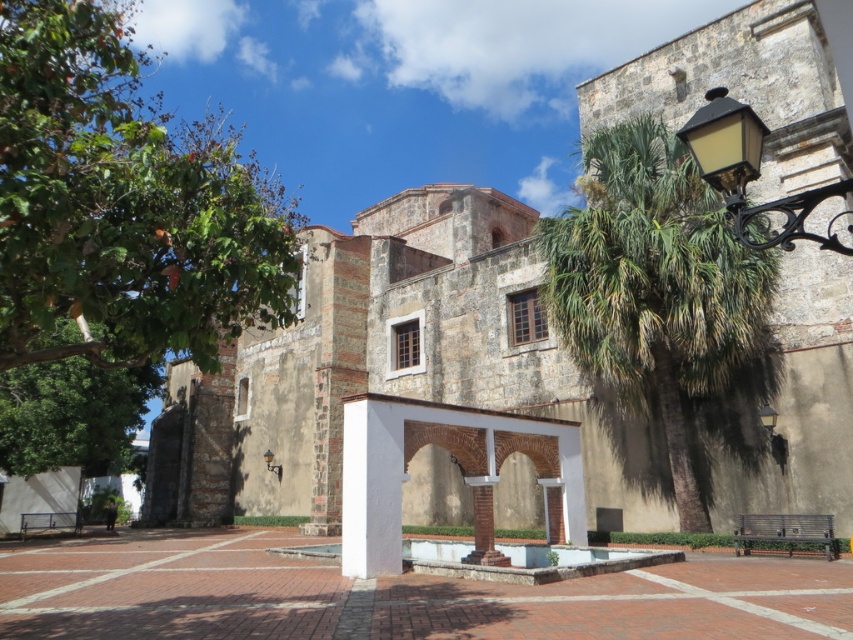
Is green leafy tree at upper left closer to camera compared to black wrought iron lamp post at upper right?

No, it is not.

Can you confirm if green leafy tree at upper left is positioned to the right of black wrought iron lamp post at upper right?

No, green leafy tree at upper left is not to the right of black wrought iron lamp post at upper right.

The image size is (853, 640). Describe the element at coordinates (122, 205) in the screenshot. I see `green leafy tree at upper left` at that location.

This screenshot has height=640, width=853. Identify the location of green leafy tree at upper left. click(122, 205).

Does black wrought iron lamp post at upper right come behind matte black lamp at center?

That is False.

Consider the image. Who is lower down, black wrought iron lamp post at upper right or matte black lamp at center?

matte black lamp at center is lower down.

Who is more forward, (820,243) or (273,468)?

Point (820,243)

The image size is (853, 640). In order to click on black wrought iron lamp post at upper right in this screenshot , I will do `click(751, 172)`.

Can you confirm if green leafy palm at right is thinner than matte black lamp at center?

No, green leafy palm at right is not thinner than matte black lamp at center.

Does green leafy palm at right appear under matte black lamp at center?

No, green leafy palm at right is not below matte black lamp at center.

You are a GUI agent. You are given a task and a screenshot of the screen. Output one action in this format:
    pyautogui.click(x=<x>, y=<y>)
    Task: Click on the green leafy palm at right
    This screenshot has height=640, width=853.
    Given the screenshot: What is the action you would take?
    pyautogui.click(x=654, y=288)

The width and height of the screenshot is (853, 640). Identify the location of green leafy palm at right. (654, 288).